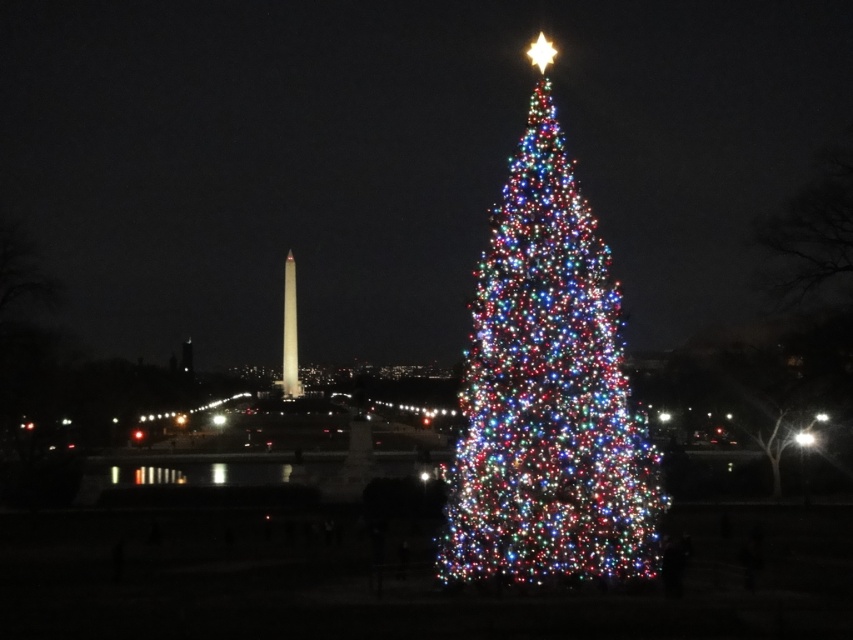
Is illuminated plastic christmas tree at center wider than white marble obelisk at center?

Yes.

Is point (567, 368) farther from viewer compared to point (283, 396)?

No, (567, 368) is closer to viewer.

Is point (607, 561) more distant than point (294, 348)?

No, it is not.

What are the coordinates of `illuminated plastic christmas tree at center` in the screenshot? It's located at (547, 390).